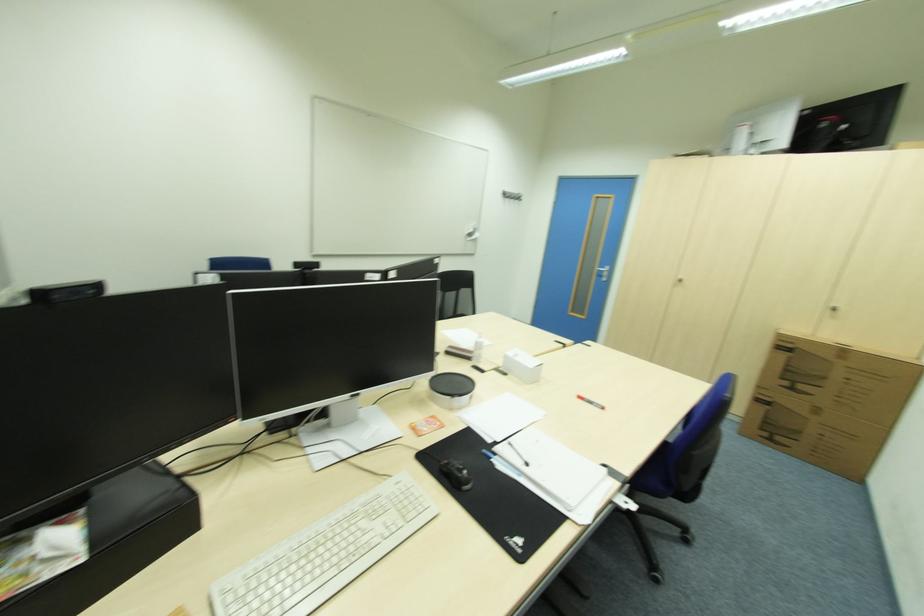
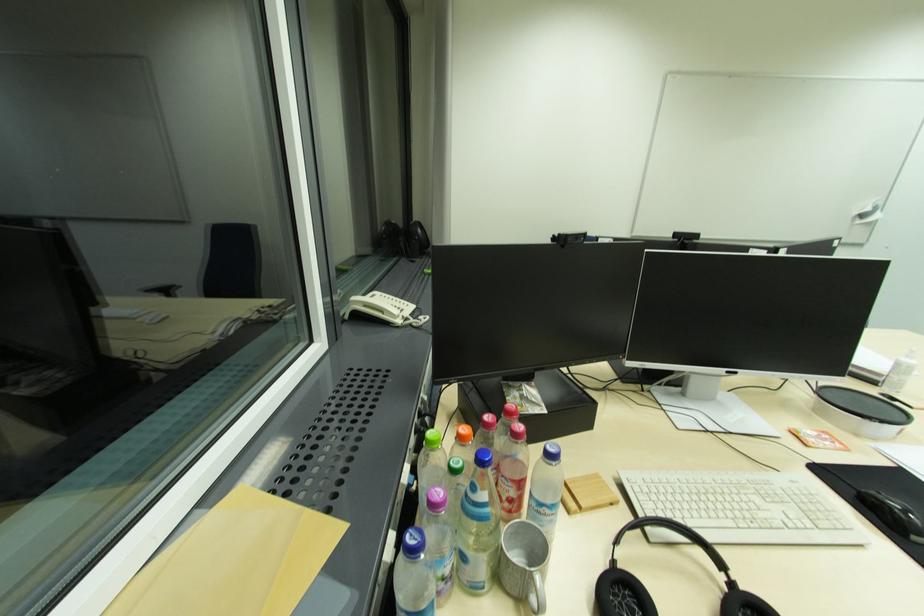
Question: The first image is from the beginning of the video and the second image is from the end. How did the camera likely rotate when shooting the video?

Choices:
 (A) Left
 (B) Right
 (C) Up
 (D) Down

Answer: (A)